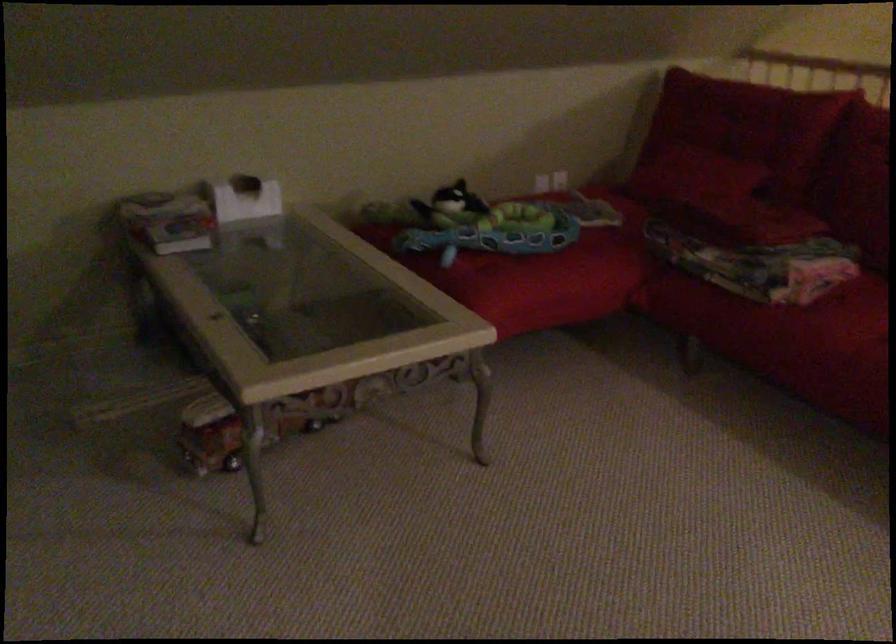
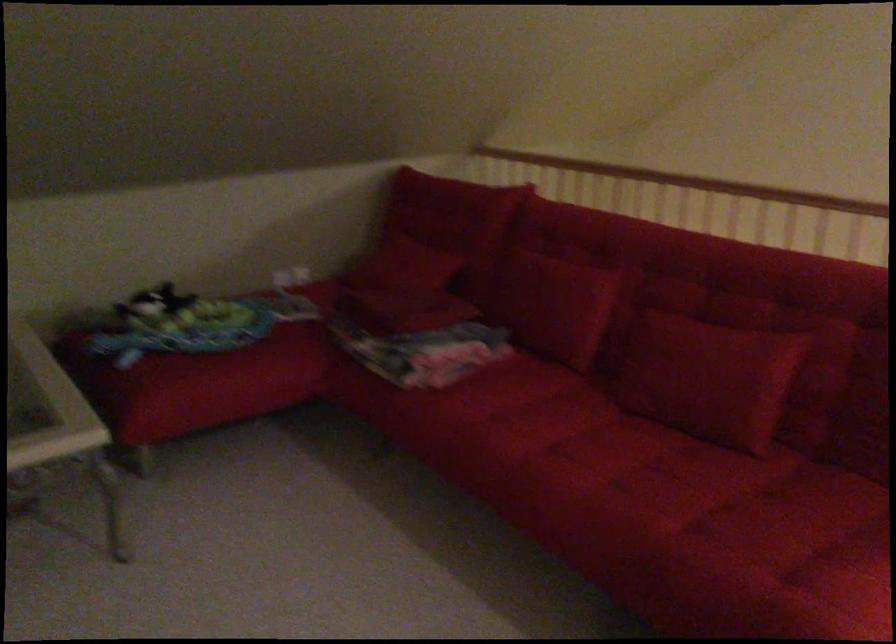
In the second image, find the point that corresponds to [705,196] in the first image.

(402, 287)